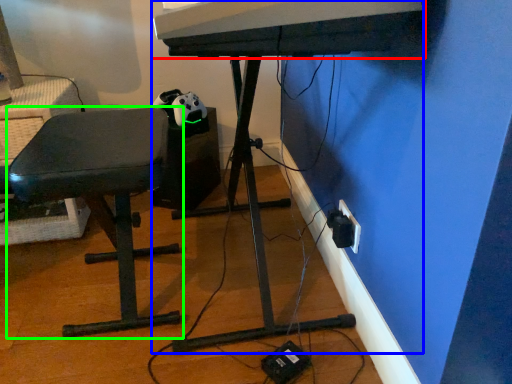
Question: Estimate the real-world distances between objects in this image. Which object is closer to musical keyboard (highlighted by a red box), computer desk (highlighted by a blue box) or furniture (highlighted by a green box)?

Choices:
 (A) computer desk
 (B) furniture

Answer: (B)